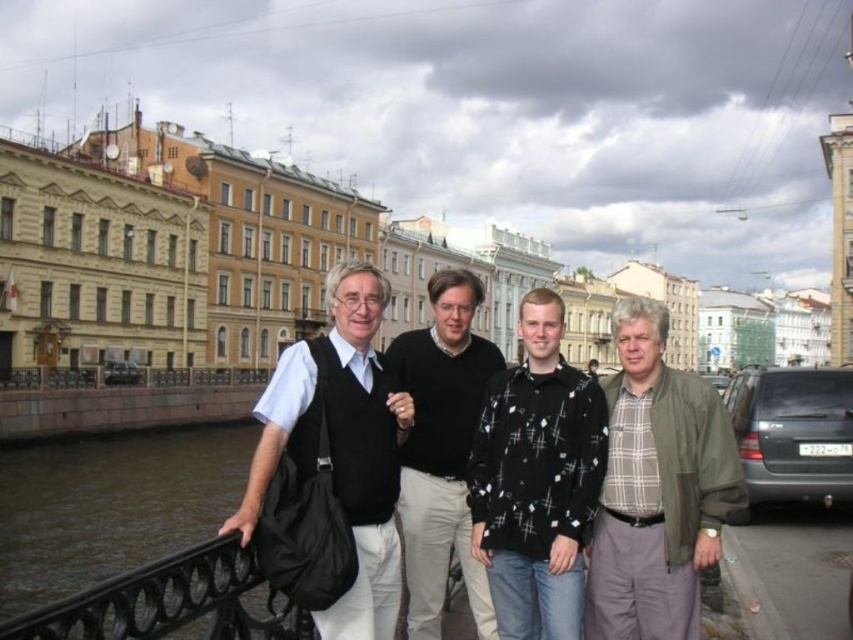
Question: Does black woven shirt at center have a larger size compared to black wrought iron railing at lower left?

Choices:
 (A) yes
 (B) no

Answer: (B)

Question: Which point is closer to the camera taking this photo?

Choices:
 (A) (225, 564)
 (B) (523, 483)
 (C) (654, 356)

Answer: (A)

Question: Can you confirm if plaid cotton shirt at right is positioned to the left of black wrought iron railing at lower left?

Choices:
 (A) no
 (B) yes

Answer: (A)

Question: Which object is positioned farthest from the plaid cotton shirt at right?

Choices:
 (A) matte black vest at center
 (B) black sweater at center
 (C) black woven shirt at center

Answer: (A)

Question: Can you confirm if plaid cotton shirt at right is positioned below matte black vest at center?

Choices:
 (A) yes
 (B) no

Answer: (A)

Question: Which object is closer to the camera taking this photo?

Choices:
 (A) black sweater at center
 (B) matte black vest at center
 (C) black wrought iron railing at lower left
 (D) plaid cotton shirt at right

Answer: (C)